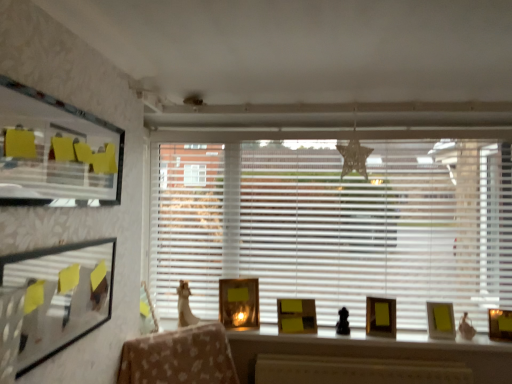
You are a GUI agent. You are given a task and a screenshot of the screen. Output one action in this format:
    pyautogui.click(x=<x>, y=<y>)
    Task: Click on the vacant space to the right of matte gold picture frame at center, which is counted as the fourth picture frame, starting from the back
    
    Given the screenshot: What is the action you would take?
    413,336